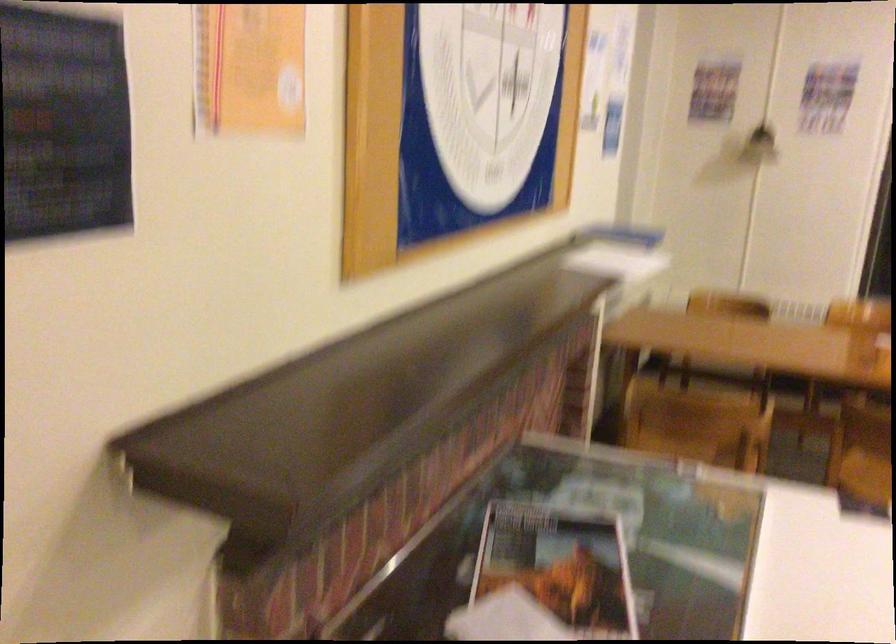
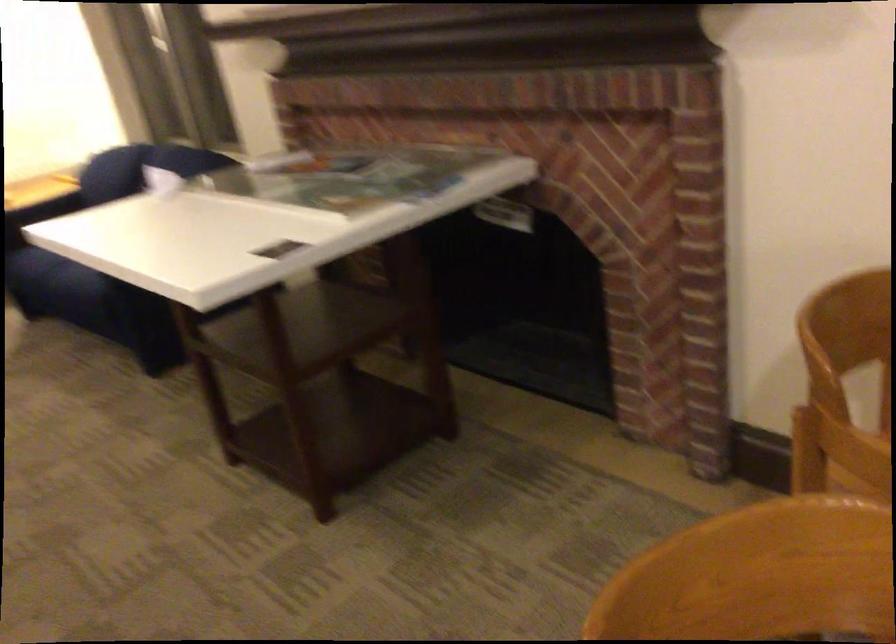
Question: I am providing you with two images of the same scene from different viewpoints. Which of the following objects are not visible in image2?

Choices:
 (A) sofa armrest
 (B) sofa sitting surface
 (C) floor lamp switch
 (D) small magazine

Answer: (D)